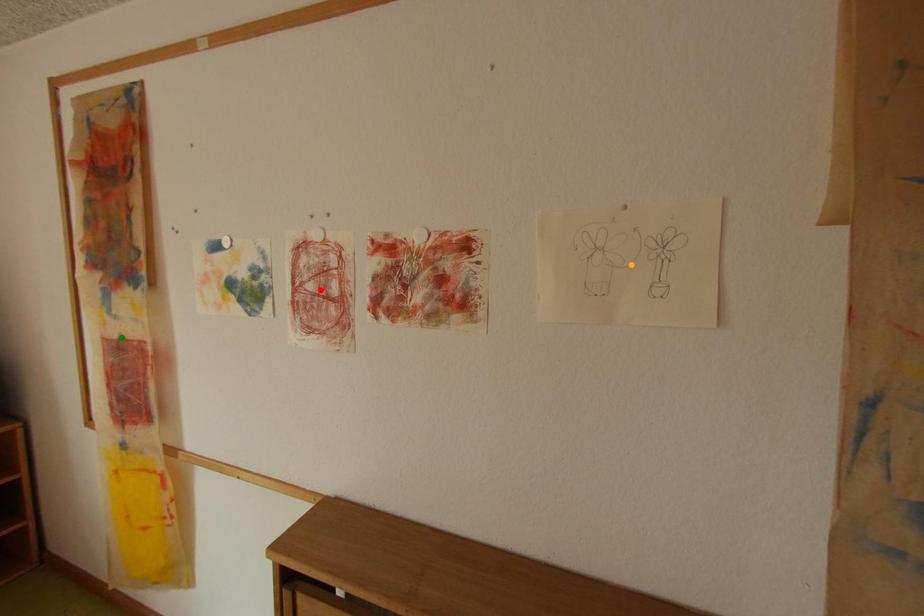
Order these from nearest to farthest:
green point, orange point, red point

green point → red point → orange point